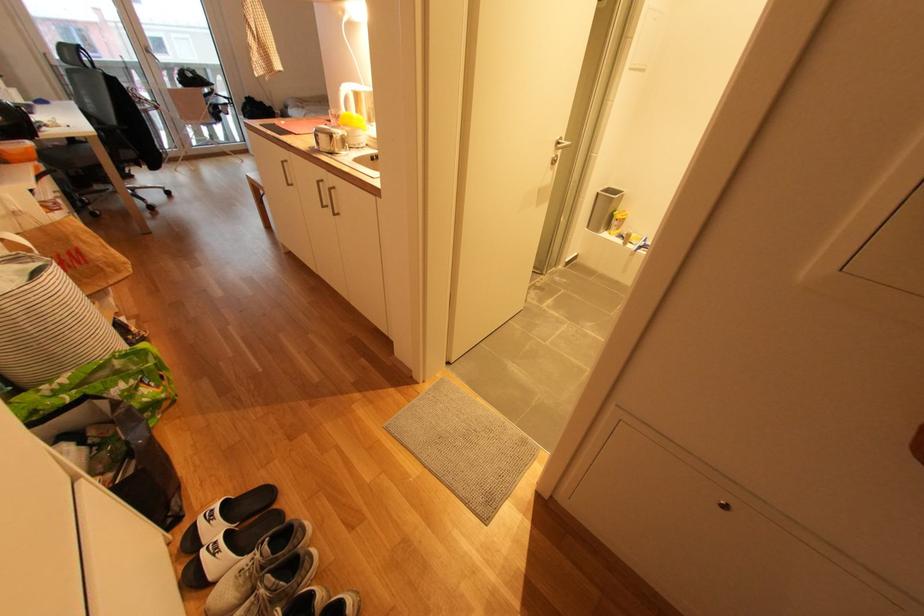
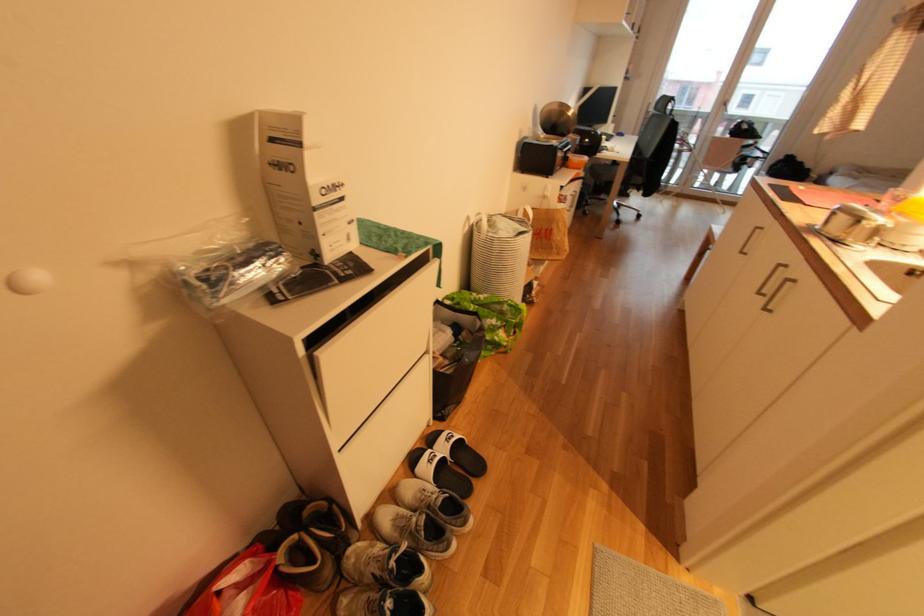
First-person continuous shooting, in which direction is the camera rotating?

The camera rotated toward left-down.